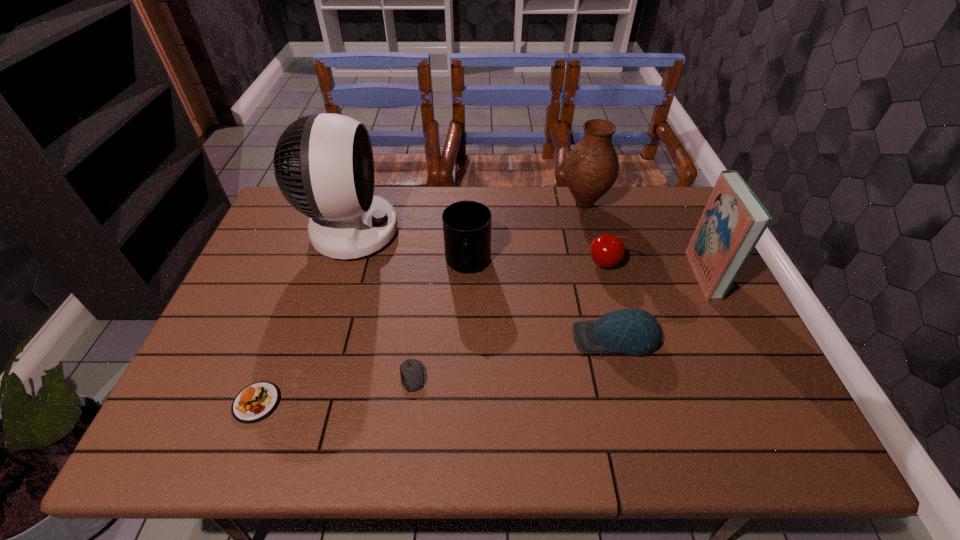
Locate an element on the screen. Image resolution: width=960 pixels, height=540 pixels. fan is located at coordinates (324, 166).

Identify the location of vase. (591, 168).

At what (x,y) coordinates should I click in order to perform the action: click on hardback book. Please return your answer as a coordinate pair (x, y). The width and height of the screenshot is (960, 540). Looking at the image, I should click on (734, 219).

Locate an element on the screen. mug is located at coordinates (466, 224).

Locate an element on the screen. The image size is (960, 540). the fifth object from right to left is located at coordinates (466, 224).

The width and height of the screenshot is (960, 540). Find the location of `the fifth tallest object`. the fifth tallest object is located at coordinates (606, 250).

Locate an element on the screen. This screenshot has height=540, width=960. baseball cap is located at coordinates (636, 332).

Locate an element on the screen. This screenshot has height=540, width=960. the sixth tallest object is located at coordinates (636, 332).

Where is `patty (food)`? The image size is (960, 540). patty (food) is located at coordinates (255, 402).

Find the location of a particular element. the shortest object is located at coordinates (412, 376).